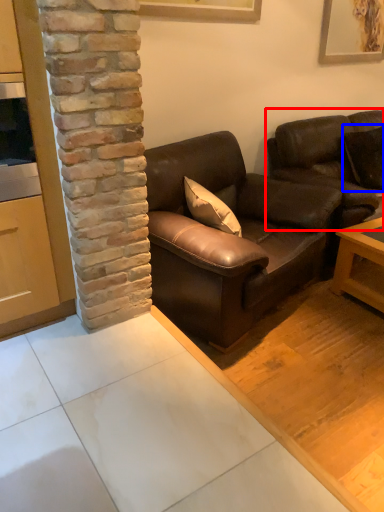
Question: Which of the following is the farthest to the observer, studio couch (highlighted by a red box) or pillow (highlighted by a blue box)?

Choices:
 (A) studio couch
 (B) pillow

Answer: (B)